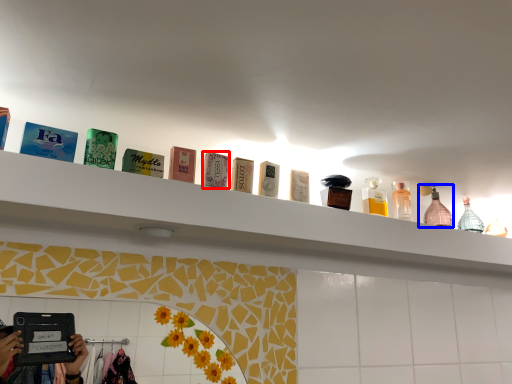
Question: Among these objects, which one is farthest to the camera, toiletry (highlighted by a red box) or mouthwash (highlighted by a blue box)?

Choices:
 (A) toiletry
 (B) mouthwash

Answer: (B)